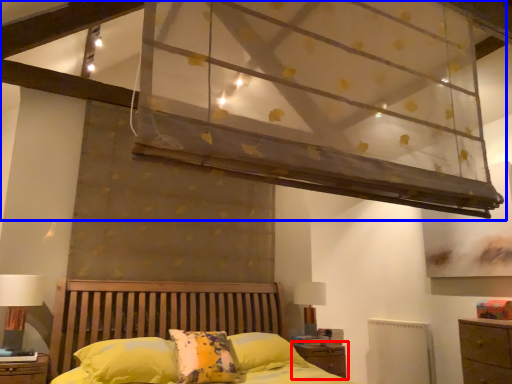
Question: Which point is closer to the camera, nightstand (highlighted by a red box) or canopy bed (highlighted by a blue box)?

Choices:
 (A) nightstand
 (B) canopy bed

Answer: (B)